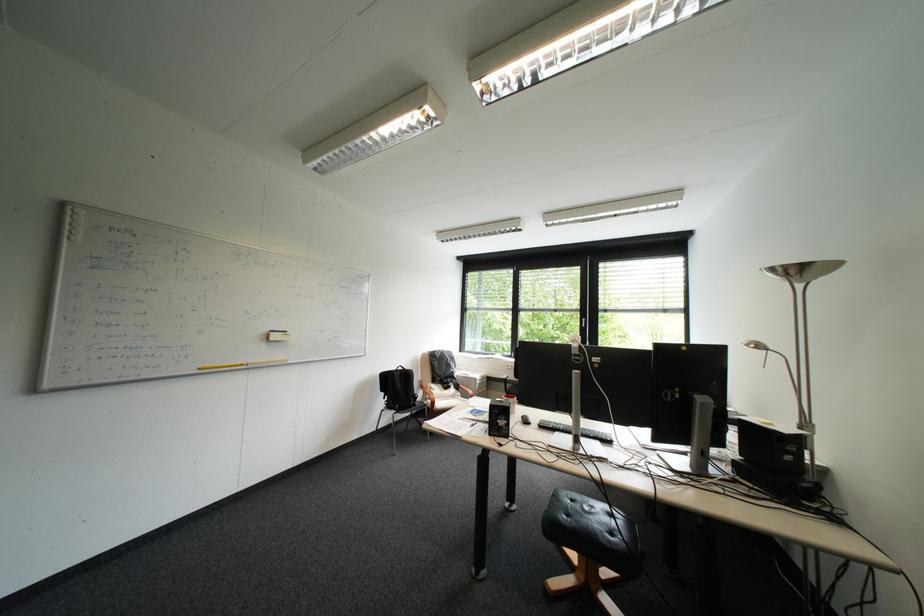
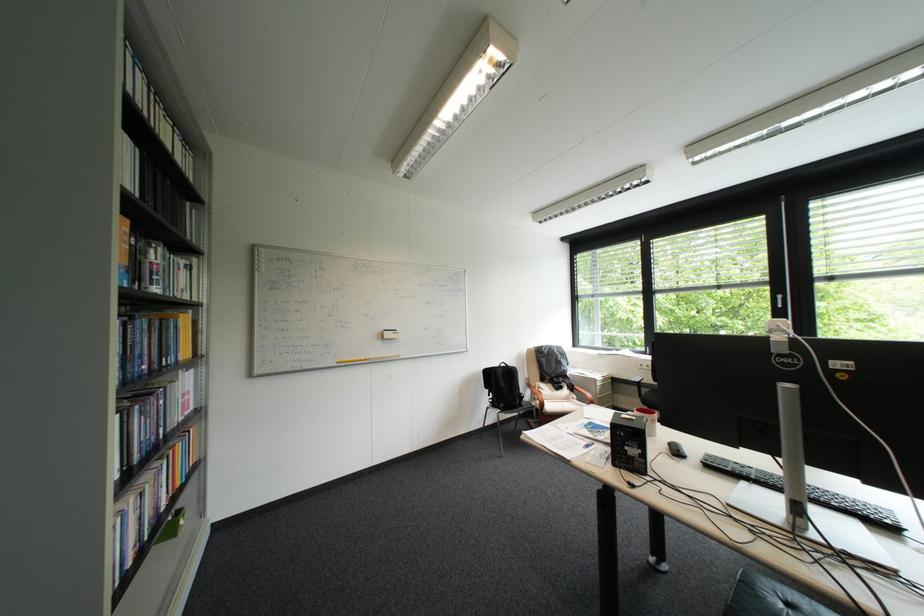
The point at (394, 391) is marked in the first image. Where is the corresponding point in the second image?

(497, 387)